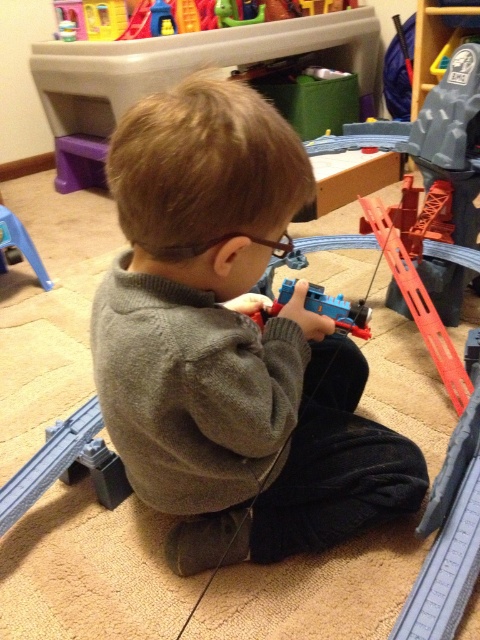
You are a robot trying to navigate to a specific point in the room. You are currently at point (396, 477). You need to move to point (338, 296). According to the scene, which direction should you move to reach your destination?

Point (396, 477) is in front of point (338, 296). To reach point (338, 296), you should move backward since it is behind your current position.

You are a child trying to place a toy on the floor. You have two points marked on the floor where you can place it. The first point is at coordinates point [339,296] and the second point is at coordinates point [6,230]. Which point is closer to you?

Point [339,296] is closer to the viewer than point [6,230], so you should place the toy there if you want it closer to you.

You are a parent trying to organize the child play area. You need to place a new toy that requires a flat surface. The blue plastic toy train at center and the blue plastic toy at left are currently on the carpet. Which toy is closer to you so you can move it first?

The blue plastic toy train at center is closer to you because it is in front of the blue plastic toy at left, so you can move it first.